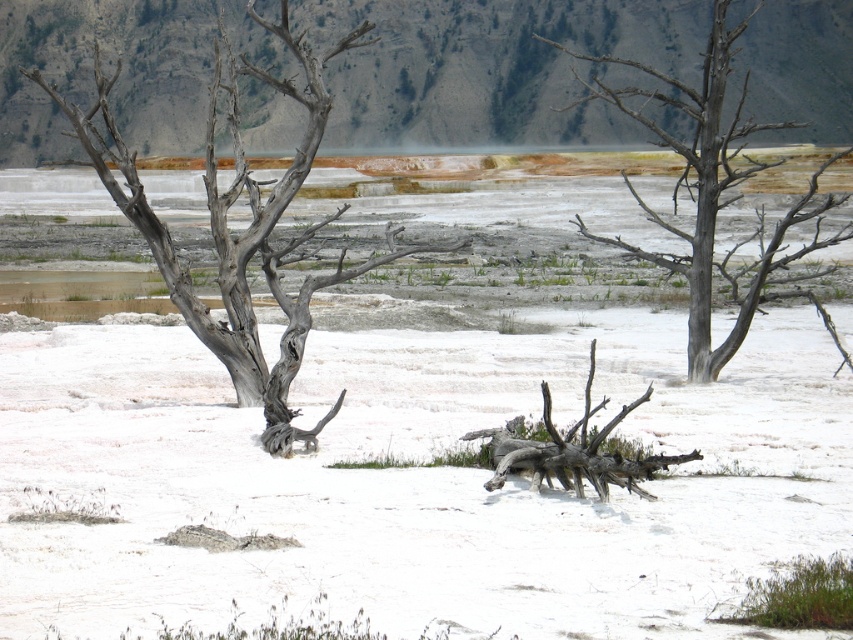
Question: Which of the following is the closest to the observer?

Choices:
 (A) (94, 72)
 (B) (724, 35)

Answer: (B)

Question: Which of the following is the farthest from the observer?

Choices:
 (A) [279, 282]
 (B) [726, 172]

Answer: (A)

Question: From the image, what is the correct spatial relationship of gray rough bark tree at left in relation to gray bark tree at right?

Choices:
 (A) right
 (B) left

Answer: (B)

Question: Can you confirm if gray rough bark tree at left is positioned to the right of gray bark tree at right?

Choices:
 (A) no
 (B) yes

Answer: (A)

Question: Does gray rough bark tree at left have a smaller size compared to gray bark tree at right?

Choices:
 (A) no
 (B) yes

Answer: (A)